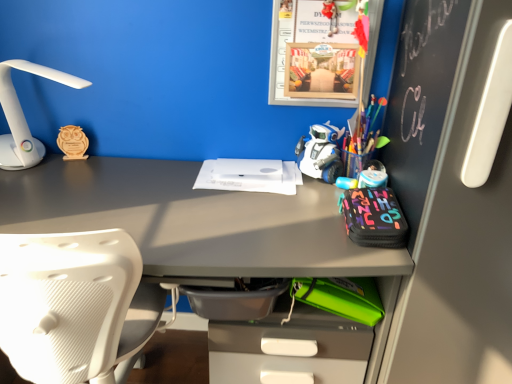
At what (x,y) coordinates should I click in order to perform the action: click on free space in front of white plastic robot at center. Please return your answer as a coordinate pair (x, y). The image size is (512, 384). Looking at the image, I should click on coord(308,204).